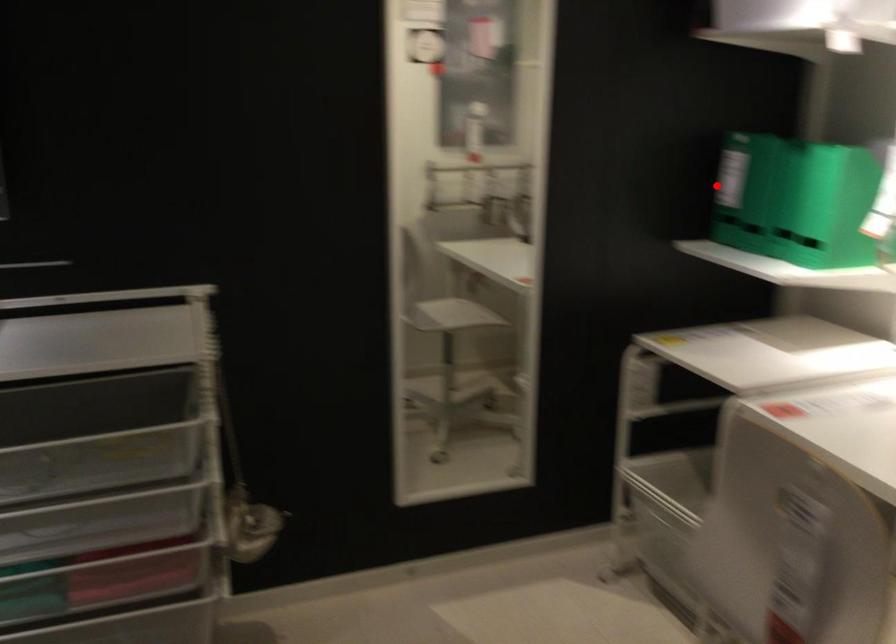
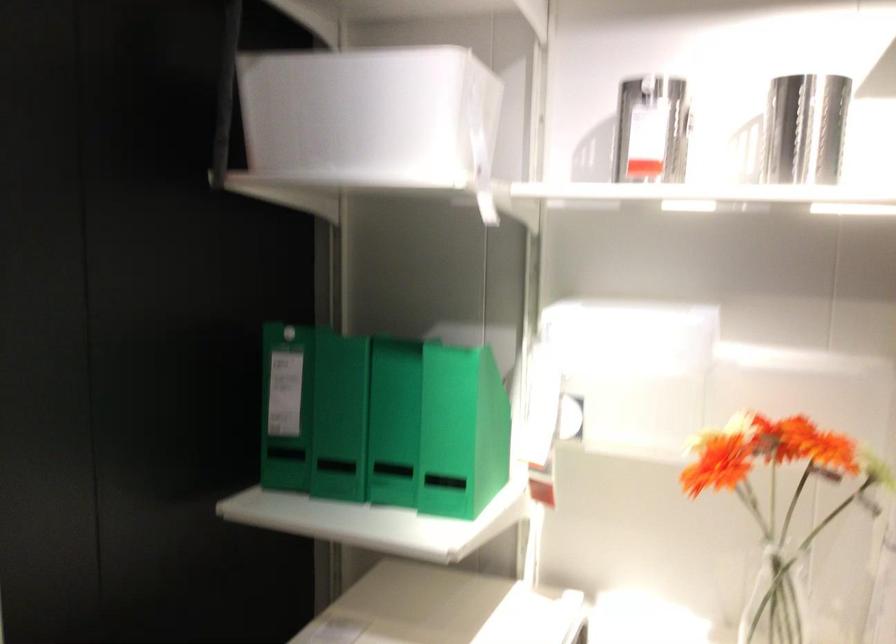
The point at the highlighted location is marked in the first image. Where is the corresponding point in the second image?

(286, 406)